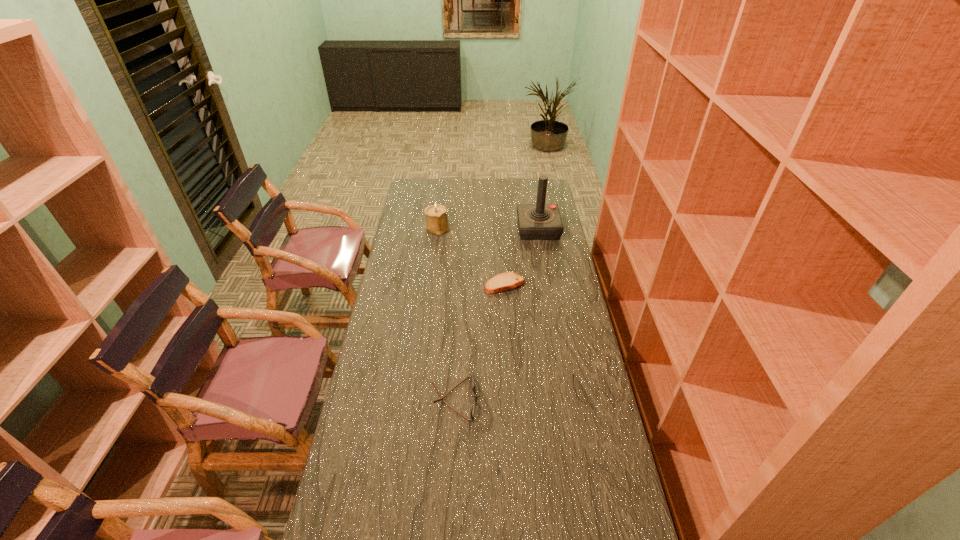
Identify the location of vacant point located between the nearest object and the third shortest object. This screenshot has width=960, height=540. (445, 313).

Identify the location of object that is the second closest to the tallest object. Image resolution: width=960 pixels, height=540 pixels. (436, 215).

Select which object is the third closest to the joystick. Please provide its 2D coordinates. Your answer should be formatted as a tuple, i.e. [(x, y)], where the tuple contains the x and y coordinates of a point satisfying the conditions above.

[(472, 410)]